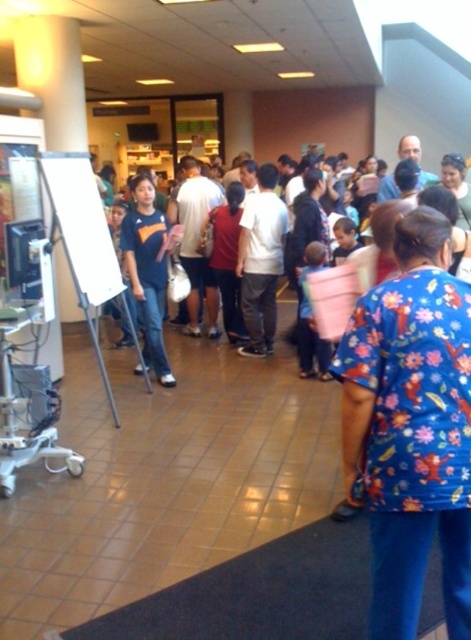
Question: Which point is farther to the camera?

Choices:
 (A) floral print scrubs at center
 (B) matte blue shirt at center

Answer: (B)

Question: Is floral print scrubs at center bigger than matte blue shirt at center?

Choices:
 (A) no
 (B) yes

Answer: (A)

Question: Observing the image, what is the correct spatial positioning of floral print scrubs at center in reference to matte blue shirt at center?

Choices:
 (A) right
 (B) left

Answer: (A)

Question: Which point appears farthest from the camera in this image?

Choices:
 (A) (146, 262)
 (B) (380, 356)

Answer: (A)

Question: Is floral print scrubs at center below matte blue shirt at center?

Choices:
 (A) yes
 (B) no

Answer: (A)